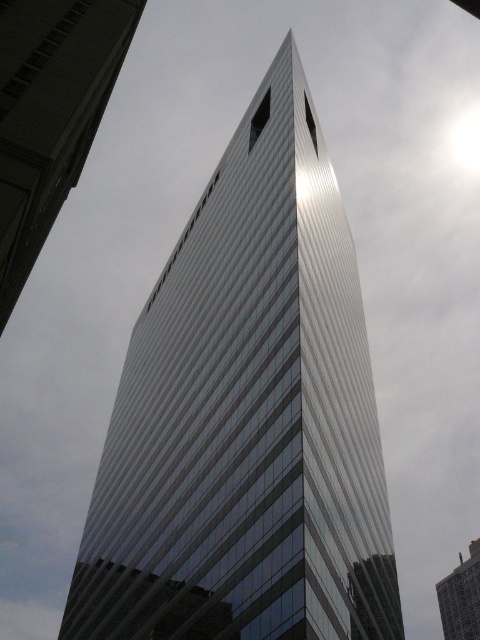
You are a drone operator who needs to fly your drone between the white glass building at center and the sleek silver skyscraper at center. Based on their heights, which building should you aim to pass under to ensure safe flight?

The white glass building at center is taller than the sleek silver skyscraper at center, so you should aim to pass under the sleek silver skyscraper at center to ensure safe flight.

In the scene shown: You are standing at the base of the white glass building at center. If you look directly upward, will you see the top of the building before the clouds?

The white glass building at center is located at point (247,417), so yes, you will see the top of the white glass building at center before the clouds since it is positioned below the clouds in the sky.

You are standing at the base of the skyscraper and looking upward. There are two points marked on the building facade. The first point is at coordinates point [249,244] and the second is at point [100,48]. Which point is closer to the triangular peak at the top of the skyscraper?

Point [249,244] is closer to the triangular peak at the top of the skyscraper because it is higher up on the building facade than point [100,48].